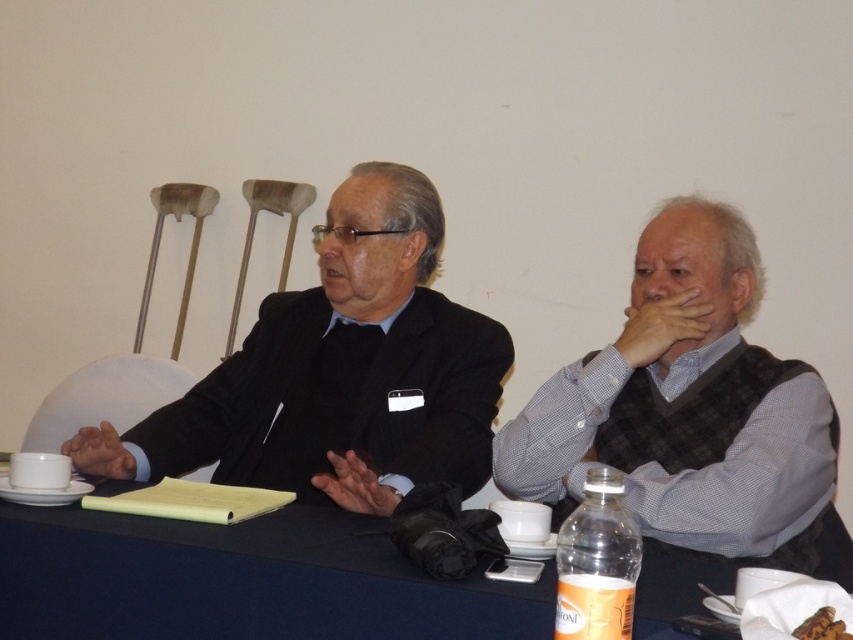
Question: Which object appears farthest from the camera in this image?

Choices:
 (A) matte black suit at center
 (B) blue fabric table at center
 (C) clear plastic bottle at lower right

Answer: (A)

Question: Where is clear plastic bottle at lower right located in relation to brown crumbly bread at center in the image?

Choices:
 (A) left
 (B) right

Answer: (A)

Question: Which point is closer to the camera?

Choices:
 (A) clear plastic bottle at lower right
 (B) gray checkered vest at right
 (C) brown crumbly bread at center
 (D) blue fabric table at center

Answer: (A)

Question: Is gray checkered vest at right smaller than clear plastic bottle at lower right?

Choices:
 (A) no
 (B) yes

Answer: (A)

Question: Which of the following is the closest to the observer?

Choices:
 (A) brown crumbly bread at center
 (B) clear plastic bottle at lower right

Answer: (B)

Question: Is blue fabric table at center further to camera compared to clear plastic bottle at lower right?

Choices:
 (A) yes
 (B) no

Answer: (A)